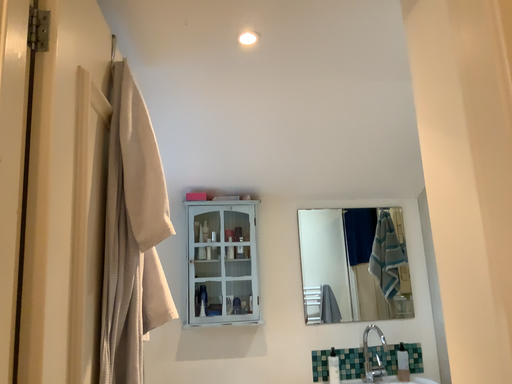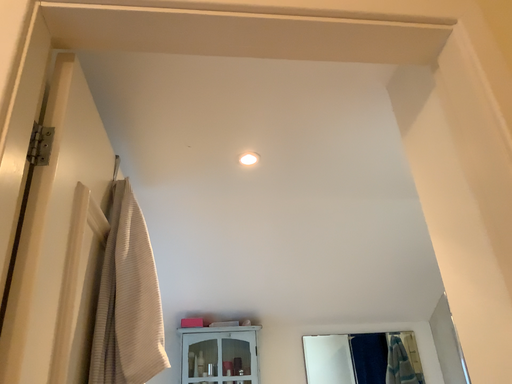
Question: How did the camera likely rotate when shooting the video?

Choices:
 (A) rotated downward
 (B) rotated upward

Answer: (B)